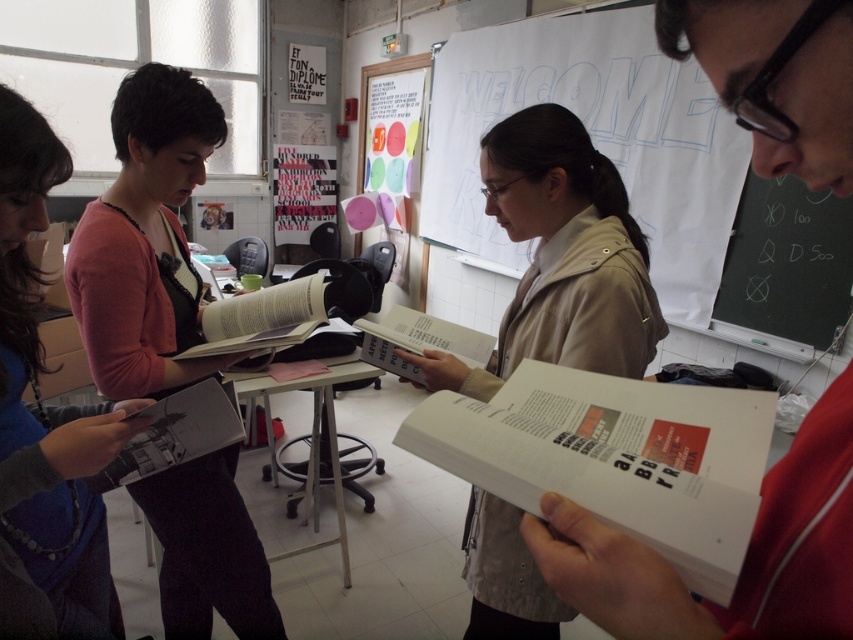
Where is `white paper at upper center`? white paper at upper center is located at coordinates (643, 173).

Can you confirm if white paper at upper center is positioned to the left of white paper book at center?

No, white paper at upper center is not to the left of white paper book at center.

Is point (720, 186) less distant than point (763, 88)?

No.

The width and height of the screenshot is (853, 640). I want to click on white paper at upper center, so click(643, 173).

Who is taller, white paper at upper center or beige fabric jacket at center?

Standing taller between the two is white paper at upper center.

Which is behind, point (730, 132) or point (523, 166)?

Point (730, 132)

Is point (595, 106) behind point (514, 362)?

That is True.

Locate an element on the screen. Image resolution: width=853 pixels, height=640 pixels. white paper at upper center is located at coordinates (643, 173).

Is matte pink sweater at center bigger than beige fabric jacket at center?

Yes.

Who is shorter, matte pink sweater at center or beige fabric jacket at center?

With less height is beige fabric jacket at center.

Which is behind, point (67, 268) or point (636, 332)?

The point (67, 268) is more distant.

The height and width of the screenshot is (640, 853). What are the coordinates of `matte pink sweater at center` in the screenshot? It's located at (144, 241).